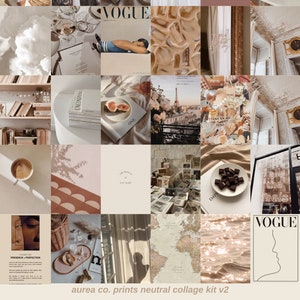
Identify the location of photos in the corner of the collage. The image size is (300, 300). (30, 259), (259, 258), (269, 36), (23, 36).